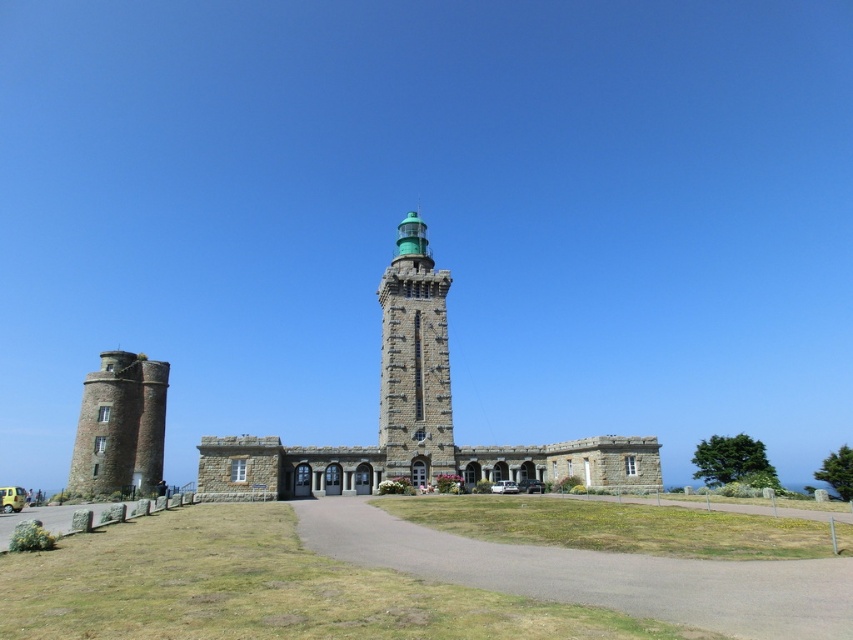
Question: Which point is closer to the camera?

Choices:
 (A) (155, 396)
 (B) (369, 522)
 (C) (392, 397)

Answer: (B)

Question: Which point appears closest to the camera in this image?

Choices:
 (A) (476, 561)
 (B) (125, 461)
 (C) (405, 406)

Answer: (A)

Question: Does gravel path at center appear over stone tower at left?

Choices:
 (A) no
 (B) yes

Answer: (A)

Question: Does green stone bell tower at center appear on the right side of stone tower at left?

Choices:
 (A) no
 (B) yes

Answer: (B)

Question: Is gravel path at center thinner than green stone bell tower at center?

Choices:
 (A) yes
 (B) no

Answer: (B)

Question: Which object is the farthest from the stone tower at left?

Choices:
 (A) green stone bell tower at center
 (B) gravel path at center

Answer: (B)